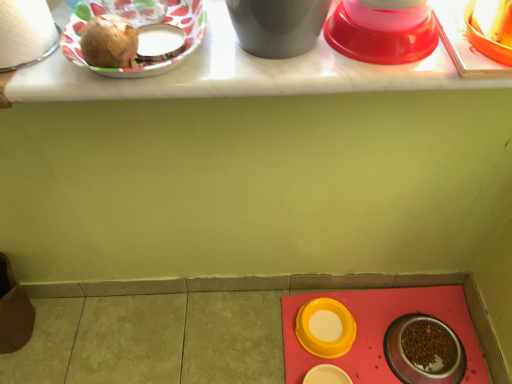
This screenshot has width=512, height=384. In order to click on free location to the left of yellow plastic bowl at lower center, the first tableware from the back in this screenshot , I will do tap(260, 354).